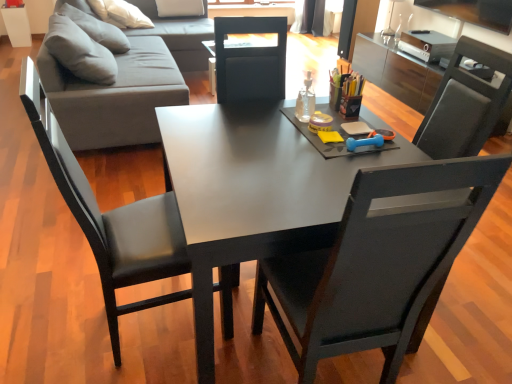
Question: Looking at the image, does transparent glass bottle at center seem bigger or smaller compared to gray fabric couch at upper left?

Choices:
 (A) big
 (B) small

Answer: (B)

Question: From the image's perspective, is transparent glass bottle at center located above or below gray fabric couch at upper left?

Choices:
 (A) below
 (B) above

Answer: (A)

Question: Estimate the real-world distances between objects in this image. Which object is farther from the black leather chair at center, arranged as the 2th chair when viewed from the left?

Choices:
 (A) transparent glass bottle at center
 (B) black glossy tv at upper right
 (C) black leather chair at left, the 2th chair positioned from the right
 (D) gray fabric couch at upper left
 (E) matte black desk at center

Answer: (B)

Question: Estimate the real-world distances between objects in this image. Which object is closer to the transparent glass bottle at center?

Choices:
 (A) matte black desk at center
 (B) black glossy tv at upper right
 (C) black leather chair at center, arranged as the 2th chair when viewed from the left
 (D) gray fabric couch at upper left
 (E) black leather chair at left, the 2th chair positioned from the right

Answer: (A)